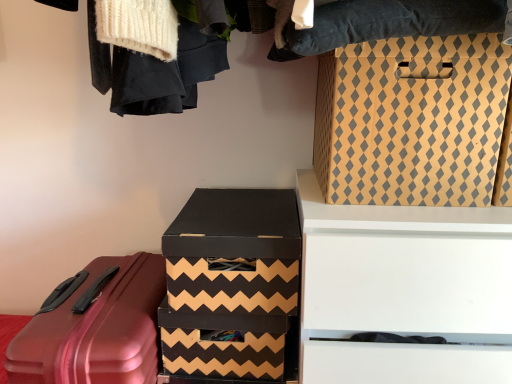
Question: Considering the relative sizes of shiny red suitcase at lower left and white matte drawer at upper right in the image provided, is shiny red suitcase at lower left bigger than white matte drawer at upper right?

Choices:
 (A) yes
 (B) no

Answer: (B)

Question: From the image's perspective, does shiny red suitcase at lower left appear higher than white matte drawer at upper right?

Choices:
 (A) no
 (B) yes

Answer: (A)

Question: Are shiny red suitcase at lower left and white matte drawer at upper right far apart?

Choices:
 (A) no
 (B) yes

Answer: (A)

Question: Is shiny red suitcase at lower left next to white matte drawer at upper right and touching it?

Choices:
 (A) no
 (B) yes

Answer: (A)

Question: Is shiny red suitcase at lower left at the left side of white matte drawer at upper right?

Choices:
 (A) no
 (B) yes

Answer: (B)

Question: Looking at the image, does matte cardboard box at upper right, the 3th box in the bottom-to-top sequence, seem bigger or smaller compared to white matte drawer at upper right?

Choices:
 (A) small
 (B) big

Answer: (A)

Question: In the image, is matte cardboard box at upper right, arranged as the 1th box when viewed from the top, on the left side or the right side of white matte drawer at upper right?

Choices:
 (A) left
 (B) right

Answer: (A)

Question: From a real-world perspective, is matte cardboard box at upper right, the 3th box in the bottom-to-top sequence, physically located above or below white matte drawer at upper right?

Choices:
 (A) below
 (B) above

Answer: (B)

Question: From the image's perspective, is matte cardboard box at upper right, arranged as the 1th box when viewed from the top, positioned above or below white matte drawer at upper right?

Choices:
 (A) below
 (B) above

Answer: (B)

Question: From a real-world perspective, is black cardboard box at center, the second box from the top, physically located above or below shiny red suitcase at lower left?

Choices:
 (A) above
 (B) below

Answer: (A)

Question: Looking at their shapes, would you say black cardboard box at center, marked as the 2th box in a bottom-to-top arrangement, is wider or thinner than shiny red suitcase at lower left?

Choices:
 (A) thin
 (B) wide

Answer: (A)

Question: Relative to shiny red suitcase at lower left, is black cardboard box at center, the second box from the top, in front or behind?

Choices:
 (A) front
 (B) behind

Answer: (B)

Question: Visually, is black cardboard box at center, the second box from the top, positioned to the left or to the right of shiny red suitcase at lower left?

Choices:
 (A) right
 (B) left

Answer: (A)

Question: Is point (500, 210) closer or farther from the camera than point (434, 198)?

Choices:
 (A) closer
 (B) farther

Answer: (A)

Question: In the image, is white matte drawer at upper right positioned in front of or behind matte cardboard box at upper right, the 3th box in the bottom-to-top sequence?

Choices:
 (A) front
 (B) behind

Answer: (A)